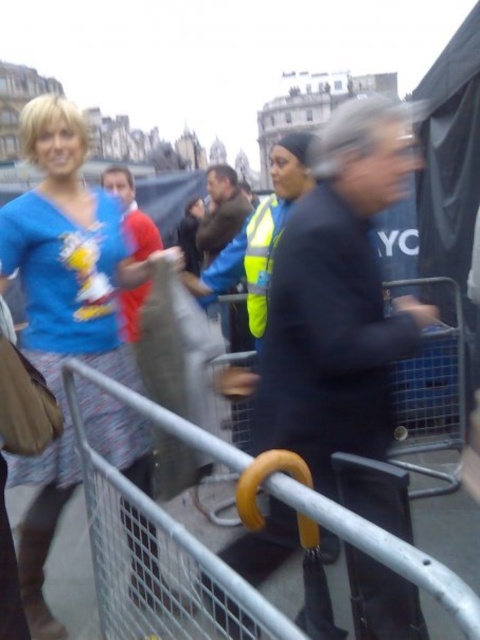
You are a photographer trying to capture a photo of the black matte jacket at center and the matte blue shirt at upper left in the same frame. Based on their positions and sizes, can you fit both in your camera viewfinder without zooming in or out?

The black matte jacket at center might be wider than matte blue shirt at upper left, so there is a possibility that the black matte jacket at center could occupy more space in the frame, but since the question is about fitting both in the viewfinder without zooming, it depends on the actual width difference. However, since the description only states that the black matte jacket at center might be wider, it doesn not confirm if the total space they occupy together exceeds the viewfinder. Thus, the answer is

You are a photographer trying to capture a photo of the black matte jacket at center and the red shirt at center in the same frame. Based on their heights, which one should you focus on first to ensure both are in focus?

The black matte jacket at center is much taller than the red shirt at center, so you should focus on the black matte jacket at center first to ensure both are in focus.

You are a photographer trying to capture a candid shot of both the black matte jacket at center and the brown leather jacket at center in the same frame. Since you can only move sideways, which direction should you move to ensure both jackets are visible?

The black matte jacket at center is positioned on the right side of the brown leather jacket at center. To include both in your frame while moving sideways, you should move to the left so that the leftward movement allows the camera to capture the brown leather jacket at center on the left and the black matte jacket at center on the right within the same frame.